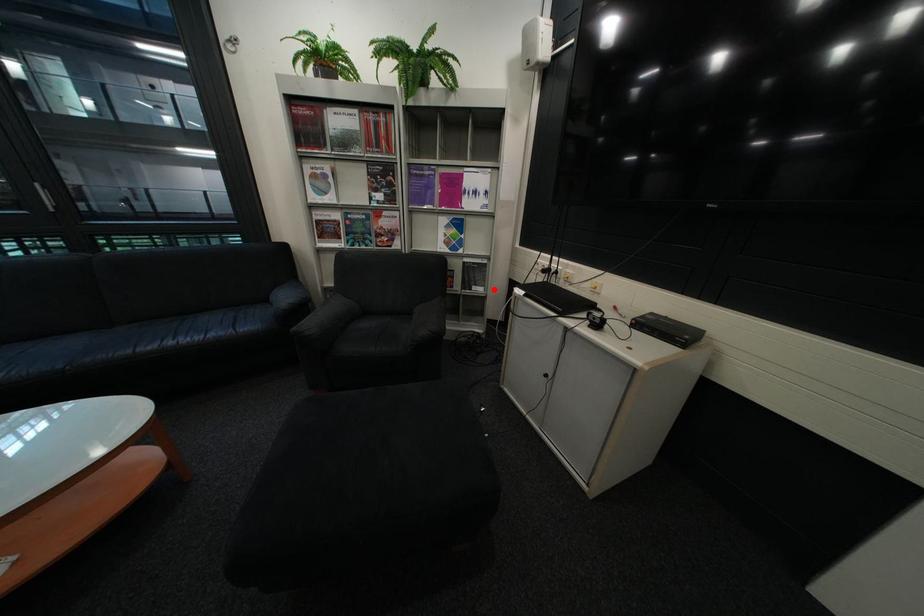
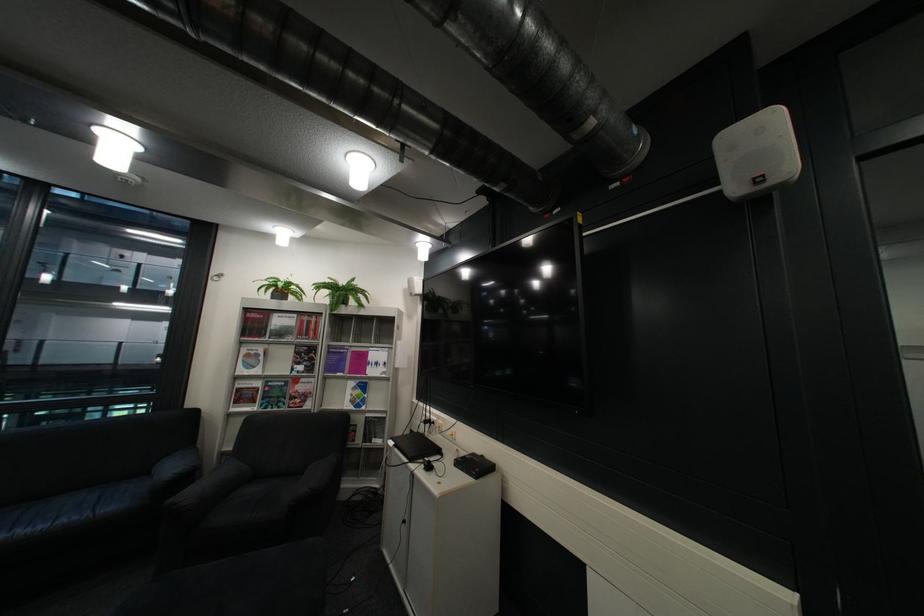
Question: I am providing you with two images of the same scene from different viewpoints. In image1, a red point is highlighted. Considering the same 3D point in image2, which of the following is correct?

Choices:
 (A) It is closer
 (B) It is farther

Answer: (B)